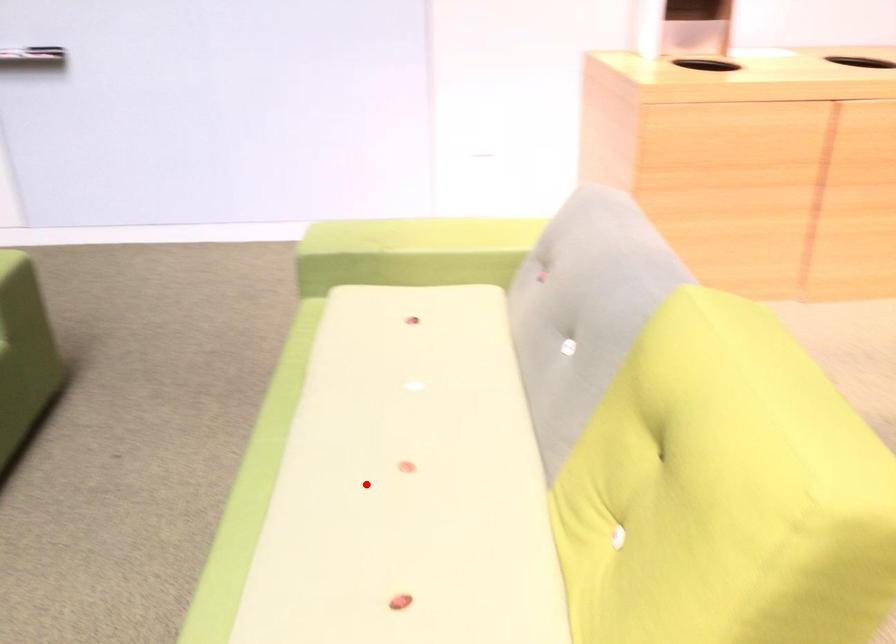
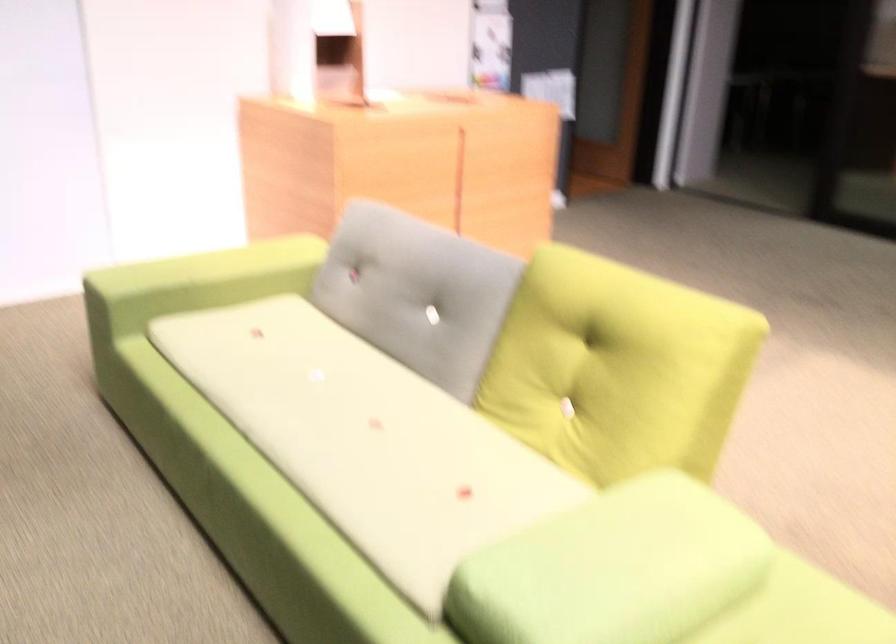
Where in the second image is the point corresponding to the highlighted location from the first image?

(366, 439)